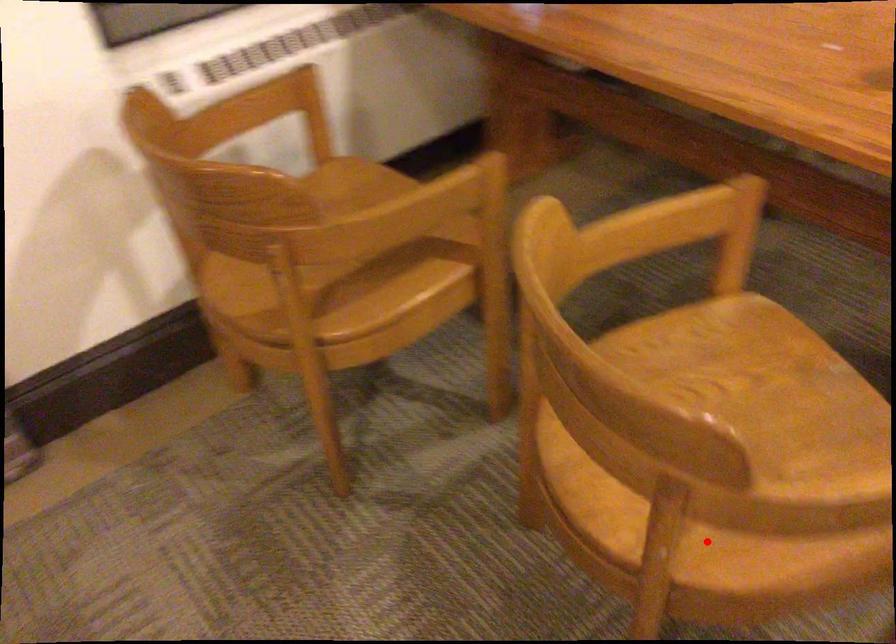
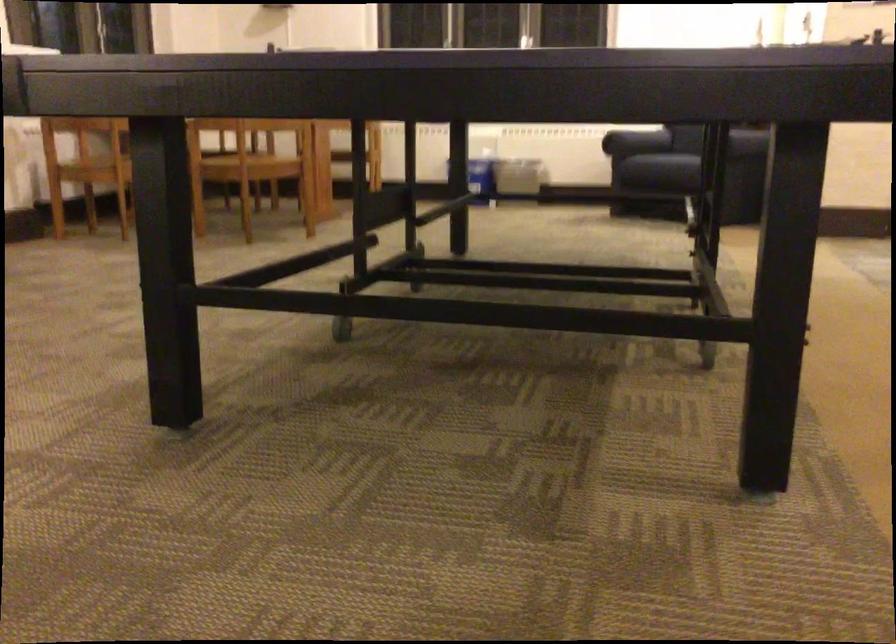
Question: I am providing you with two images of the same scene from different viewpoints. In image1, a red point is highlighted. Considering the same 3D point in image2, which of the following is correct?

Choices:
 (A) It is closer
 (B) It is farther

Answer: (B)